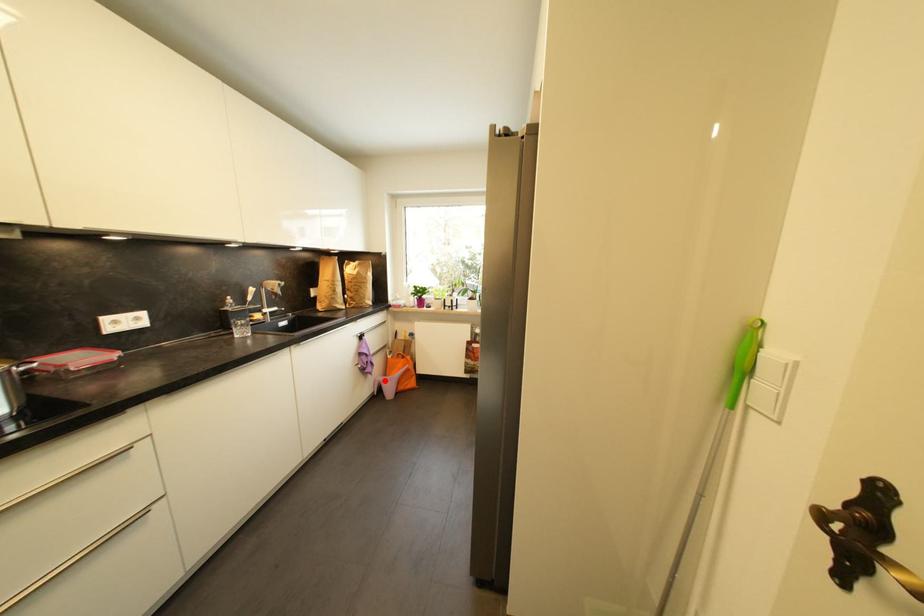
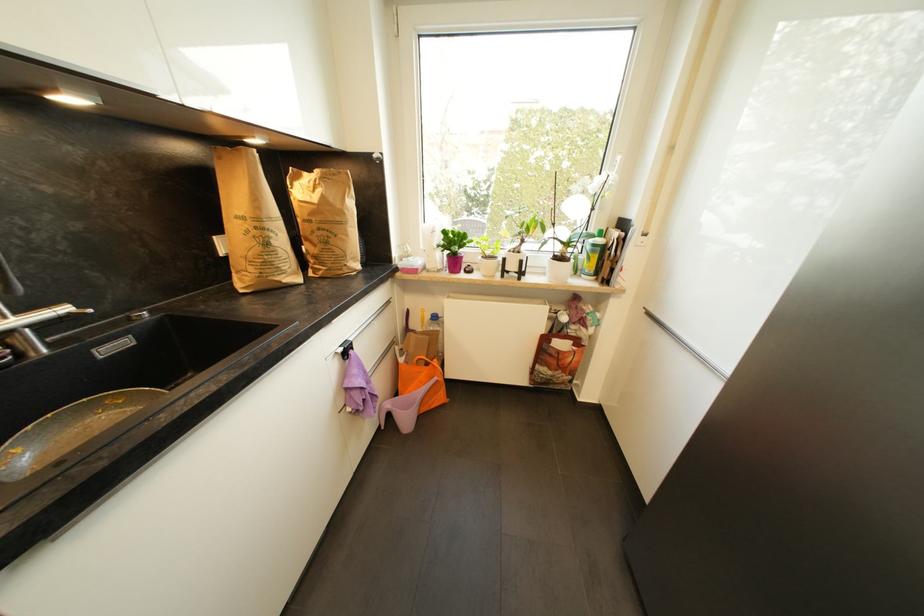
In the second image, find the point that corresponds to the highlighted location in the first image.

(393, 407)